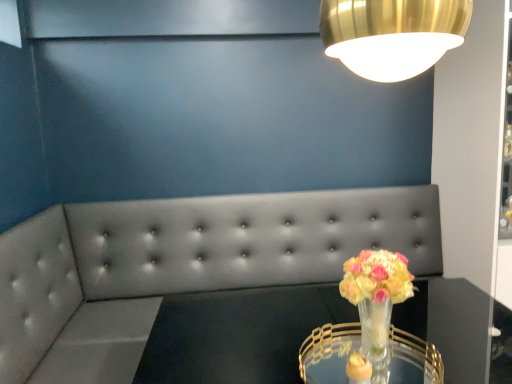
Question: Can translucent glass vase at center be found inside clear glass table at center?

Choices:
 (A) yes
 (B) no

Answer: (B)

Question: Can you confirm if clear glass table at center is positioned to the right of translucent glass vase at center?

Choices:
 (A) no
 (B) yes

Answer: (A)

Question: From a real-world perspective, is clear glass table at center beneath translucent glass vase at center?

Choices:
 (A) yes
 (B) no

Answer: (A)

Question: Is clear glass table at center shorter than translucent glass vase at center?

Choices:
 (A) yes
 (B) no

Answer: (B)

Question: Is clear glass table at center facing away from translucent glass vase at center?

Choices:
 (A) no
 (B) yes

Answer: (A)

Question: From a real-world perspective, is clear glass table at center above or below clear glass table at center?

Choices:
 (A) above
 (B) below

Answer: (B)

Question: In terms of width, does clear glass table at center look wider or thinner when compared to clear glass table at center?

Choices:
 (A) thin
 (B) wide

Answer: (B)

Question: From the image's perspective, is clear glass table at center located above or below clear glass table at center?

Choices:
 (A) above
 (B) below

Answer: (B)

Question: Would you say clear glass table at center is inside or outside clear glass table at center?

Choices:
 (A) outside
 (B) inside

Answer: (A)

Question: From their relative heights in the image, would you say clear glass table at center is taller or shorter than translucent glass vase at center?

Choices:
 (A) short
 (B) tall

Answer: (A)

Question: Considering their positions, is clear glass table at center located in front of or behind translucent glass vase at center?

Choices:
 (A) behind
 (B) front

Answer: (B)

Question: Would you say clear glass table at center is to the left or to the right of translucent glass vase at center in the picture?

Choices:
 (A) left
 (B) right

Answer: (A)

Question: In terms of size, does clear glass table at center appear bigger or smaller than translucent glass vase at center?

Choices:
 (A) small
 (B) big

Answer: (A)

Question: Considering the relative positions of translucent glass vase at center and clear glass table at center in the image provided, is translucent glass vase at center to the left or to the right of clear glass table at center?

Choices:
 (A) left
 (B) right

Answer: (B)

Question: Relative to clear glass table at center, is translucent glass vase at center in front or behind?

Choices:
 (A) behind
 (B) front

Answer: (B)